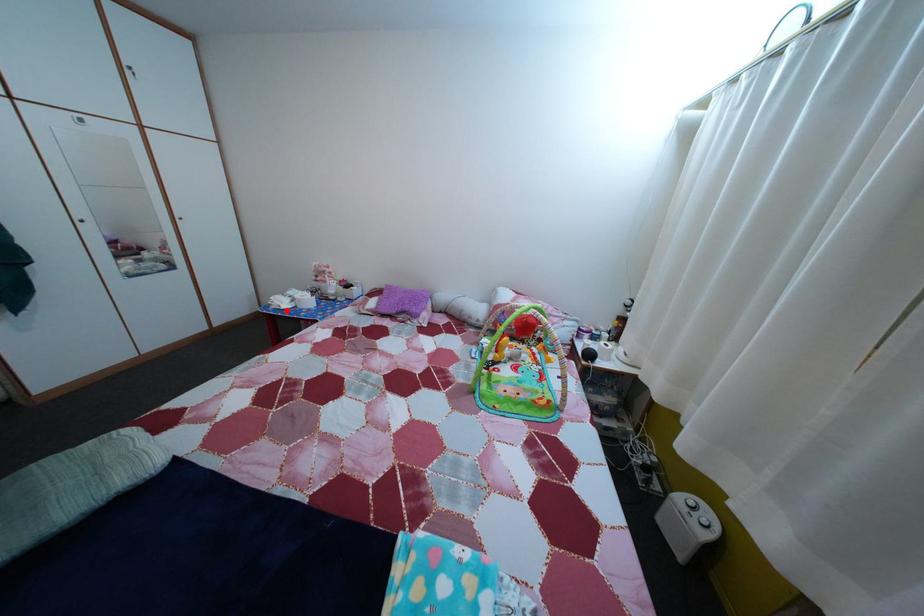
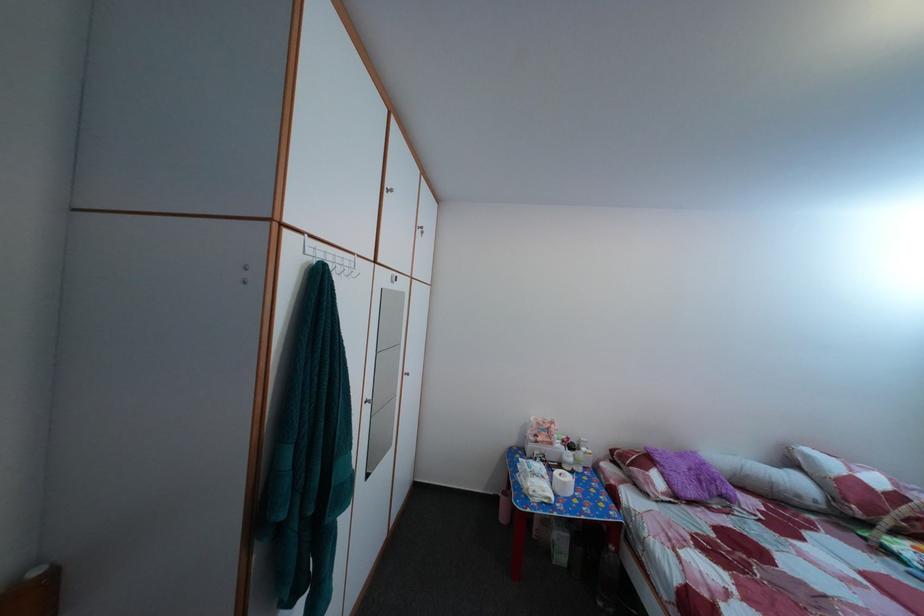
Question: I am providing you with two images of the same scene from different viewpoints. In image1, a red point is highlighted. Considering the same 3D point in image2, which of the following is correct?

Choices:
 (A) It is closer
 (B) It is farther

Answer: (B)